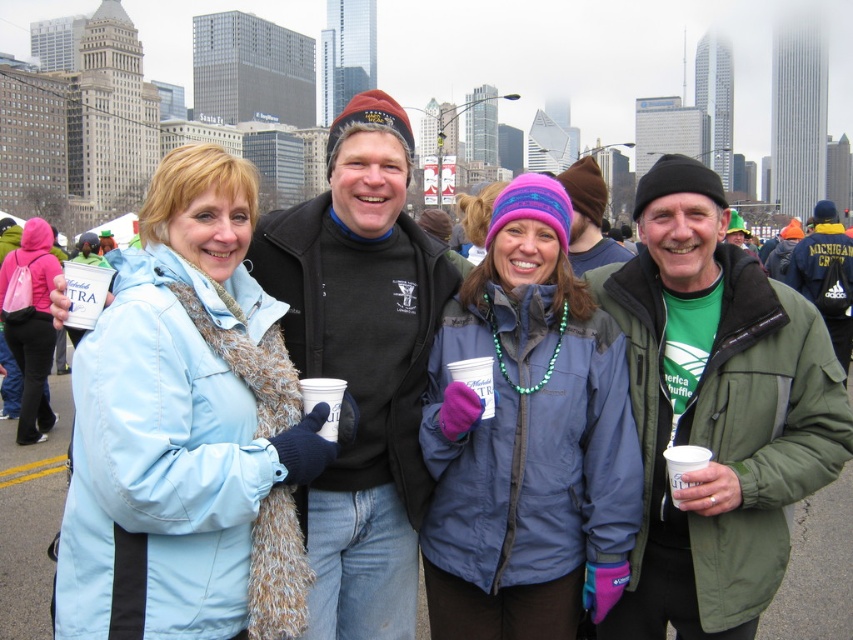
Question: Is green fabric jacket at right below white paper cup at center?

Choices:
 (A) yes
 (B) no

Answer: (B)

Question: Can you confirm if green fabric jacket at right is positioned below white paper cup at center?

Choices:
 (A) yes
 (B) no

Answer: (B)

Question: Which object appears farthest from the camera in this image?

Choices:
 (A) green fabric jacket at right
 (B) black fleece jacket at center
 (C) light blue fabric coat at left
 (D) green matte jacket at center

Answer: (A)

Question: Among these points, which one is nearest to the camera?

Choices:
 (A) (368, 104)
 (B) (323, 422)
 (C) (447, 618)

Answer: (B)

Question: Is blue nylon jacket at center positioned before white paper cup at center?

Choices:
 (A) yes
 (B) no

Answer: (B)

Question: Which of the following is the closest to the observer?

Choices:
 (A) (703, 461)
 (B) (105, 474)
 (C) (345, 385)

Answer: (B)